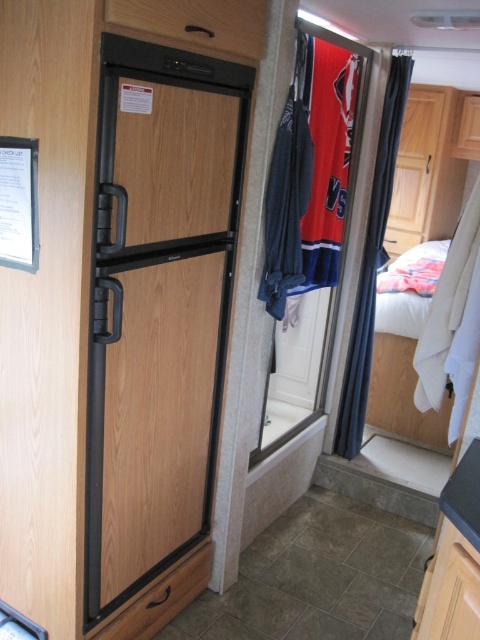
You are organizing a small kitchenette in this living space and need to place a new appliance between the black matte refrigerator at center and the wooden drawer at upper center. Since the refrigerator is to the left of the drawer, where should you position the appliance to maintain symmetry?

Since the black matte refrigerator at center is to the left of the wooden drawer at upper center, positioning the appliance between them would require placing it to the right of the refrigerator and to the left of the drawer to maintain symmetry.

You are organizing your RV and have a small tool that needs to be stored. The wooden drawer at upper center and the black wood drawer at lower center are both available. Which drawer has a larger space to accommodate the tool?

A: The wooden drawer at upper center has a larger space because its width surpasses that of the black wood drawer at lower center.

You are trying to fit a new appliance into this living space. You have a new appliance that is 1.2 meters wide. You see the black matte refrigerator at center and the black wood drawer at lower center. Which object has enough width to accommodate the new appliance?

The black matte refrigerator at center has a greater width than the black wood drawer at lower center, so it can accommodate the new appliance if its width is 1.2 meters, provided the refrigerator is at least that wide.